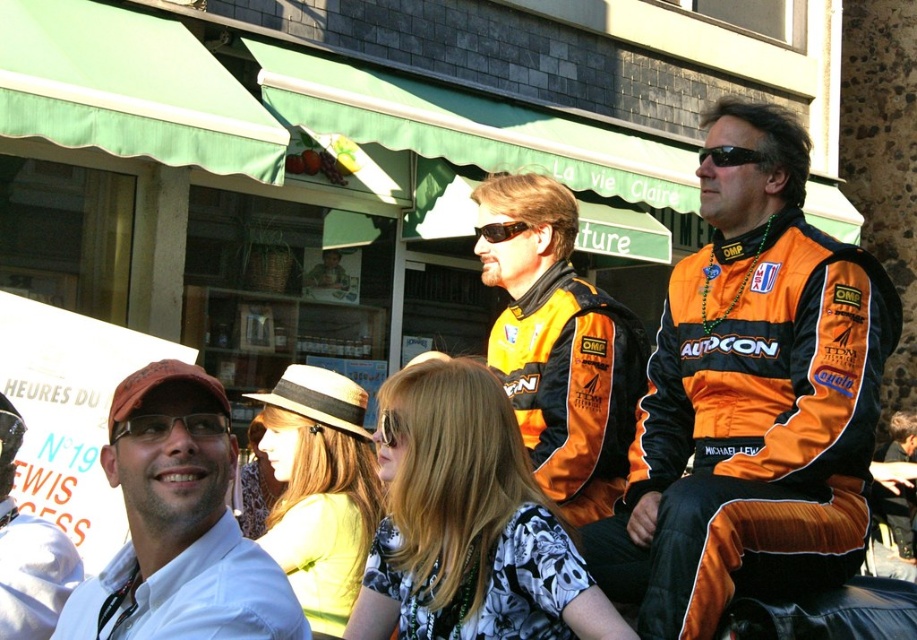
You are at a social event and want to take a photo with the matte white shirt at lower left and the brown textured sunglasses at center. Since you can only focus on one object, which one should you aim for to ensure both are in the frame?

You should aim for the brown textured sunglasses at center because the matte white shirt at lower left is to the left of it, so centering the sunglasses will keep both within the camera frame.